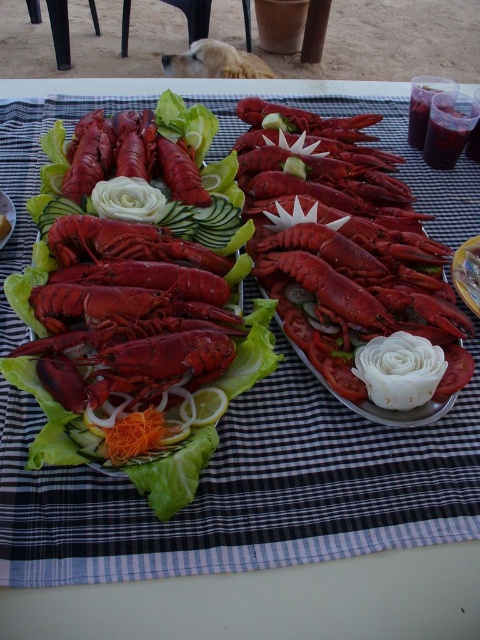
You are standing at the edge of the table looking towards the center. There are two points marked on the table surface labeled as point 1 at coordinate (460, 266) and point 2 at coordinate (0, 240). Which point is closer to you?

Point 2 at coordinate (0, 240) is closer to you because it is in front of point 1 at coordinate (460, 266).

You are a guest at this outdoor table and want to choose the larger item between the shiny red lobster at center and the smooth orange cheese at center. Which one should you pick?

The shiny red lobster at center is larger in size than the smooth orange cheese at center, so you should pick the shiny red lobster at center.